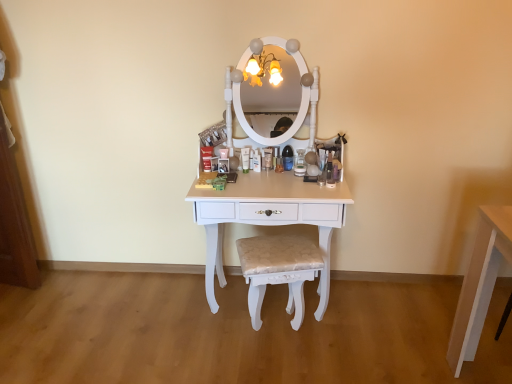
What are the coordinates of `beige fabric cushioned stool at center` in the screenshot? It's located at (278, 271).

What do you see at coordinates (245, 159) in the screenshot? I see `matte white tube at center` at bounding box center [245, 159].

In order to click on white glossy table at center in this screenshot , I will do `click(269, 217)`.

Is white glossy table at center at the right side of matte white tube at center?

Yes.

Is point (326, 188) more distant than point (246, 153)?

No, (326, 188) is closer to viewer.

This screenshot has width=512, height=384. I want to click on toiletry above the white glossy table at center (from the image's perspective), so click(245, 159).

Is matte white tube at center at the back of white glossy table at center?

That's not correct — white glossy table at center is not looking away from matte white tube at center.

Considering the positions of points (262, 294) and (338, 194), is point (262, 294) closer to camera compared to point (338, 194)?

No, (262, 294) is behind (338, 194).

How many degrees apart are the facing directions of beige fabric cushioned stool at center and white glossy table at center?

The angular difference between beige fabric cushioned stool at center and white glossy table at center is 14.4 degrees.

Locate an element on the screen. The height and width of the screenshot is (384, 512). chair below the white glossy table at center (from the image's perspective) is located at coordinates (278, 271).

Is beige fabric cushioned stool at center at the back of matte white tube at center?

No.

Is matte white tube at center positioned far away from beige fabric cushioned stool at center?

That's not correct — matte white tube at center is a little close to beige fabric cushioned stool at center.

Which object is positioned more to the right, matte white tube at center or beige fabric cushioned stool at center?

beige fabric cushioned stool at center.

Can beige fabric cushioned stool at center be found inside matte white tube at center?

No, matte white tube at center does not contain beige fabric cushioned stool at center.

Can you confirm if white glossy table at center is positioned to the left of beige fabric cushioned stool at center?

Yes, white glossy table at center is to the left of beige fabric cushioned stool at center.

From the image's perspective, which is above, white glossy table at center or beige fabric cushioned stool at center?

From the image's view, white glossy table at center is above.

Based on their sizes in the image, would you say white glossy table at center is bigger or smaller than beige fabric cushioned stool at center?

Considering their sizes, white glossy table at center takes up more space than beige fabric cushioned stool at center.

Can beige fabric cushioned stool at center be found inside white glossy table at center?

Absolutely, beige fabric cushioned stool at center is inside white glossy table at center.

Does matte white tube at center turn towards white glossy table at center?

No, matte white tube at center does not turn towards white glossy table at center.

Is white glossy table at center a part of matte white tube at center?

No, white glossy table at center is not inside matte white tube at center.

From a real-world perspective, is matte white tube at center above or below white glossy table at center?

matte white tube at center is above white glossy table at center.

Does matte white tube at center have a lesser height compared to white glossy table at center?

Indeed, matte white tube at center has a lesser height compared to white glossy table at center.

How different are the orientations of beige fabric cushioned stool at center and matte white tube at center in degrees?

beige fabric cushioned stool at center and matte white tube at center are facing 16.1 degrees away from each other.

Is beige fabric cushioned stool at center to the right of matte white tube at center from the viewer's perspective?

Yes.

Which is in front, point (295, 315) or point (243, 166)?

The point (295, 315) is closer.

From the image's perspective, between beige fabric cushioned stool at center and matte white tube at center, who is located below?

From the image's view, beige fabric cushioned stool at center is below.

Locate an element on the screen. This screenshot has height=384, width=512. table in front of the matte white tube at center is located at coordinates (269, 217).

Find the location of `table on the left of beige fabric cushioned stool at center`. table on the left of beige fabric cushioned stool at center is located at coordinates (269, 217).

Estimate the real-world distances between objects in this image. Which object is further from white glossy table at center, beige fabric cushioned stool at center or matte white tube at center?

Based on the image, matte white tube at center appears to be further to white glossy table at center.

Which object lies further to the anchor point beige fabric cushioned stool at center, white glossy table at center or matte white tube at center?

matte white tube at center lies further to beige fabric cushioned stool at center than the other object.

From the image, which object appears to be farther from matte white tube at center, beige fabric cushioned stool at center or white glossy table at center?

beige fabric cushioned stool at center is positioned further to the anchor matte white tube at center.

When comparing their distances from beige fabric cushioned stool at center, does matte white tube at center or white glossy table at center seem closer?

Among the two, white glossy table at center is located nearer to beige fabric cushioned stool at center.

Considering their positions, is white glossy table at center positioned further to matte white tube at center than beige fabric cushioned stool at center?

beige fabric cushioned stool at center lies further to matte white tube at center than the other object.

From the image, which object appears to be nearer to white glossy table at center, matte white tube at center or beige fabric cushioned stool at center?

Based on the image, beige fabric cushioned stool at center appears to be nearer to white glossy table at center.

In order to click on table between matte white tube at center and beige fabric cushioned stool at center in the vertical direction in this screenshot , I will do `click(269, 217)`.